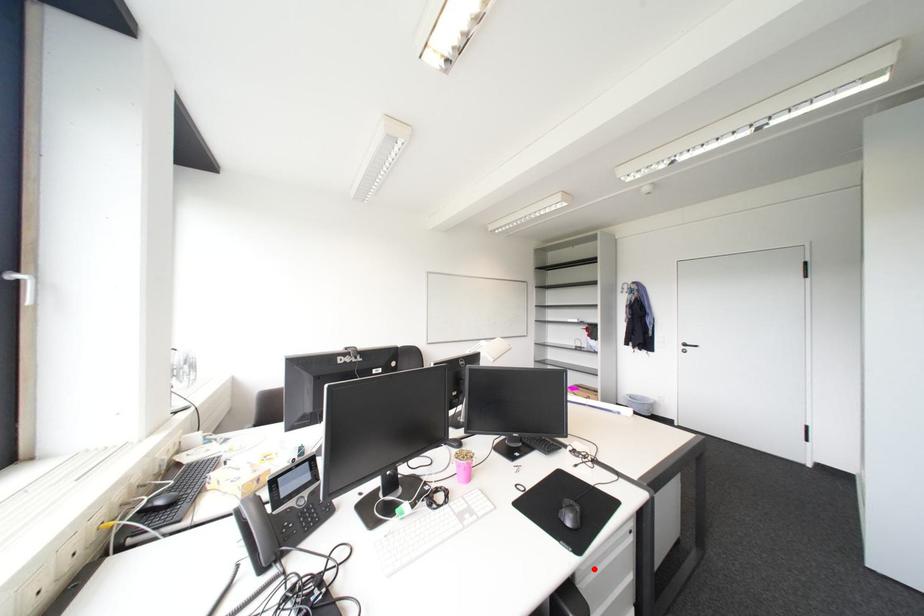
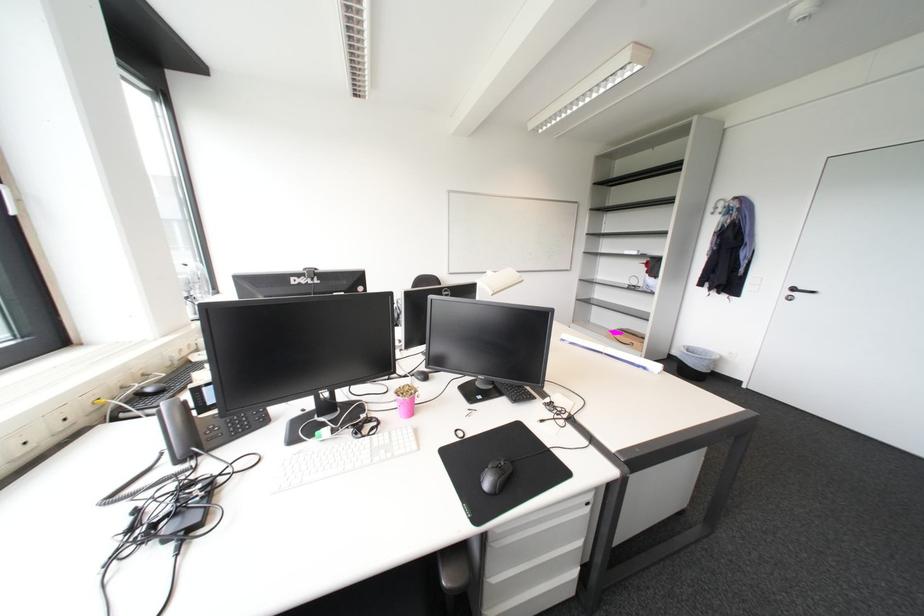
Question: I am providing you with two images of the same scene from different viewpoints. In image1, a red point is highlighted. Considering the same 3D point in image2, which of the following is correct?

Choices:
 (A) It is closer
 (B) It is farther

Answer: (B)